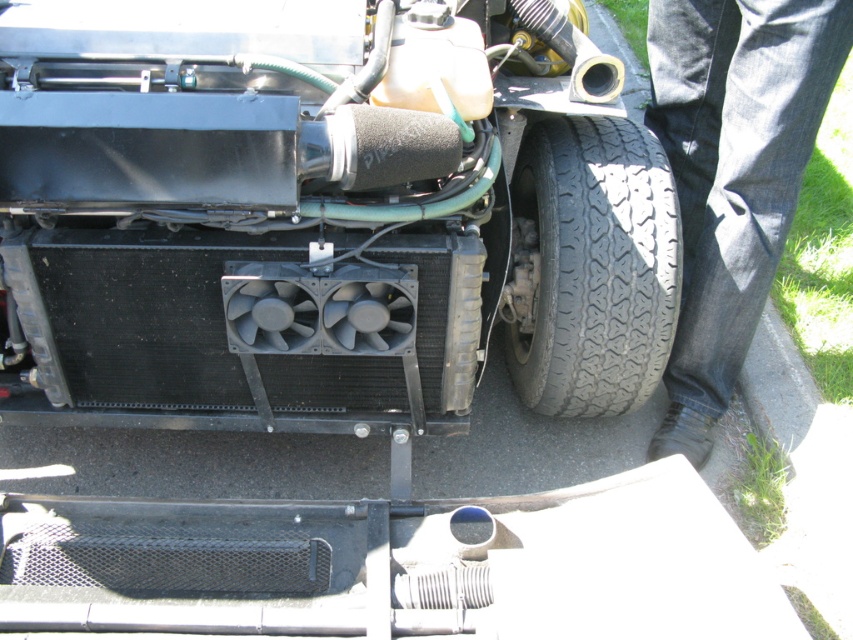
Question: Does dark blue jeans at lower right appear on the left side of black rubber tire at lower right?

Choices:
 (A) yes
 (B) no

Answer: (B)

Question: Is dark blue jeans at lower right positioned behind black rubber tire at lower right?

Choices:
 (A) yes
 (B) no

Answer: (B)

Question: Observing the image, what is the correct spatial positioning of dark blue jeans at lower right in reference to black rubber tire at lower right?

Choices:
 (A) right
 (B) left

Answer: (A)

Question: Among these points, which one is farthest from the camera?

Choices:
 (A) (648, 136)
 (B) (753, 145)

Answer: (A)

Question: Which point is farther to the camera?

Choices:
 (A) (691, 108)
 (B) (668, 339)

Answer: (A)